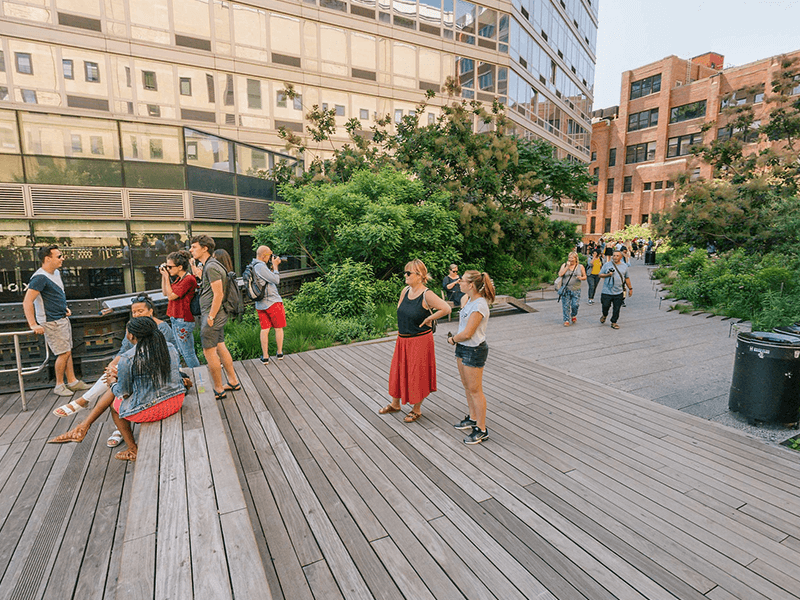
I want to click on garbage can, so click(762, 398).